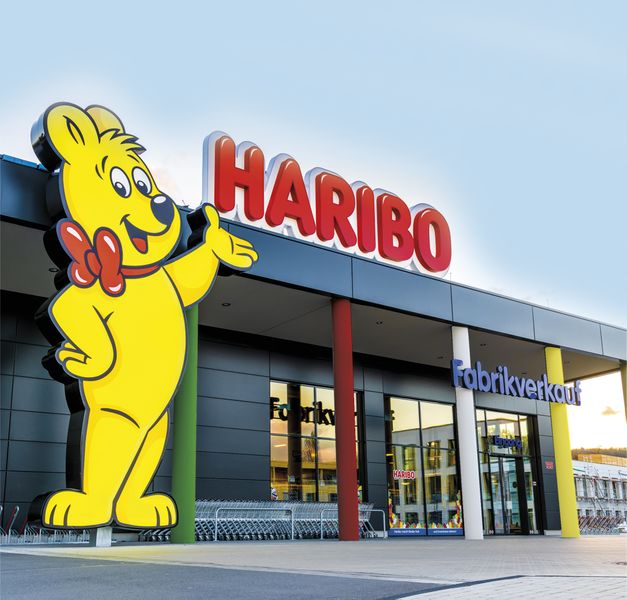
The image size is (627, 600). I want to click on door, so click(x=503, y=500).